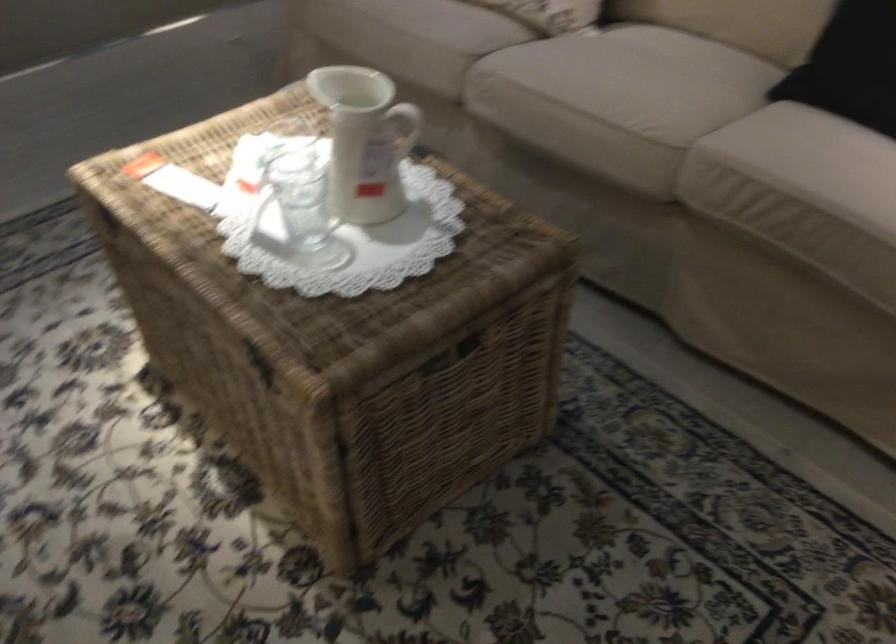
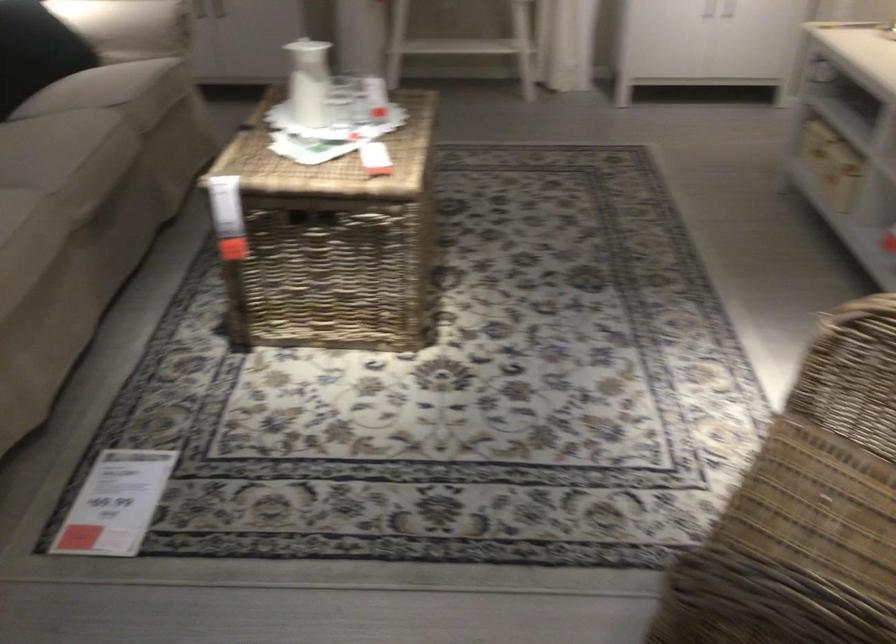
In the second image, find the point that corresponds to point 358,140 in the first image.

(308, 82)